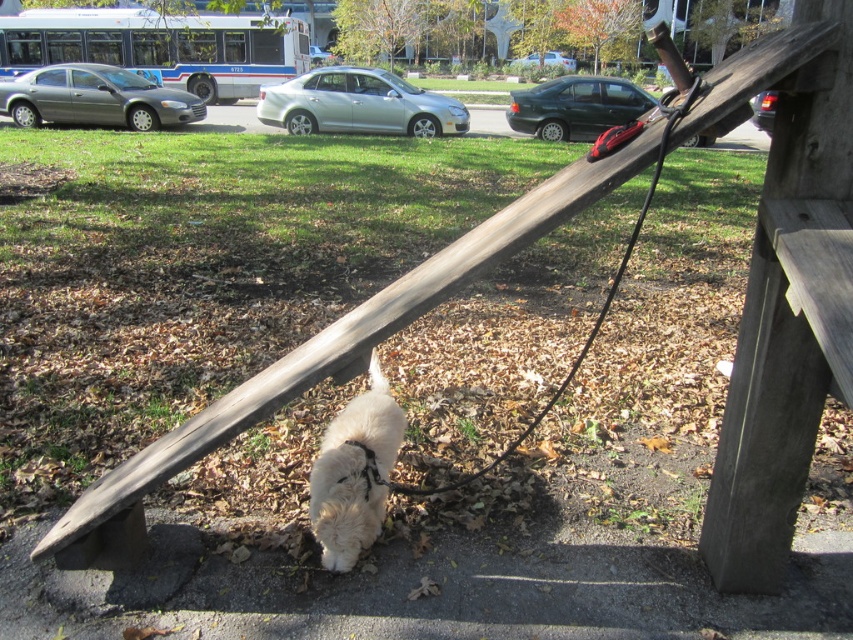
You are a photographer standing at the lower edge of the image, and you want to take a picture of the white fluffy dog at lower center. Based on its position, where should you aim your camera relative to your current position?

The white fluffy dog at lower center is located at coordinates approximately 0.739 on the horizontal axis and 0.416 on the vertical axis. Since you are at the lower edge, you should aim your camera slightly upward and to the right to capture the dog.

You are a dog owner trying to decide if your dog can comfortably sit next to the park bench without the leash getting tangled. Based on the scene, can the white fluffy dog at lower center fit comfortably next to the black rubber leash at lower center?

The white fluffy dog at lower center has a lesser width compared to the black rubber leash at lower center, so the dog can fit comfortably next to the black rubber leash at lower center without any issues.

You are a dog owner who wants to ensure your dog stays safe while walking. You have a white fluffy dog at lower center and a black rubber leash at lower center. Based on their sizes, which item would you need to adjust to ensure the leash can comfortably fit around the dog?

The white fluffy dog at lower center has a smaller size compared to the black rubber leash at lower center, so you would need to adjust the leash to a shorter length to ensure it fits comfortably around the dog.